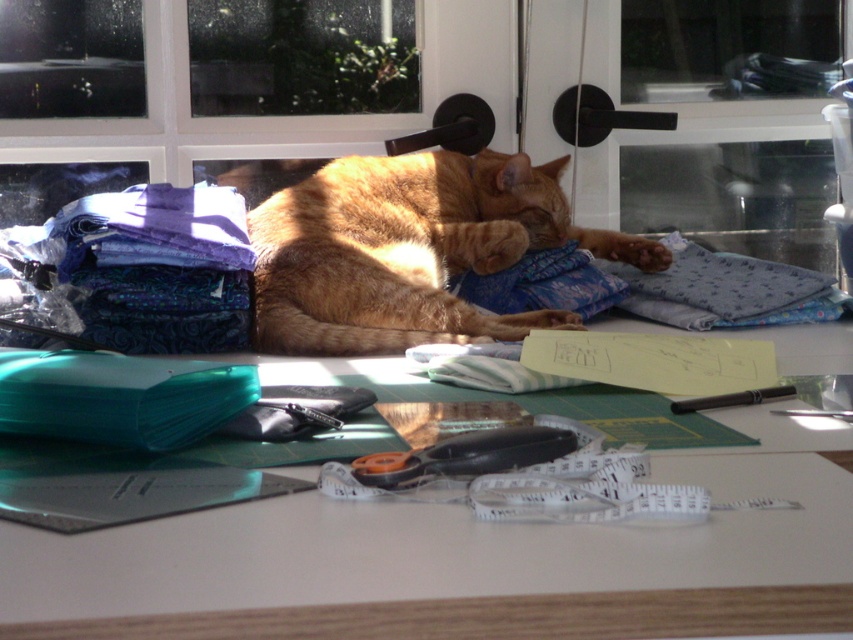
In the scene shown: You are organizing a sewing project and need to choose between the purple fabric at left and the blue fabric at center for a large cushion cover. Which fabric would you select and why?

You should choose the purple fabric at left because it is larger in size than the blue fabric at center, making it more suitable for creating a large cushion cover.

In the scene shown: You are a guest in the room and want to place a small gift on the table without disturbing the cat. Since the cat is on the table, can you place the gift on the white glossy table at center without moving the orange fur cat at center?

The white glossy table at center is in front of the orange fur cat at center, meaning the cat is closer to you than the table. Therefore, you can place the gift on the table behind the cat without disturbing it.